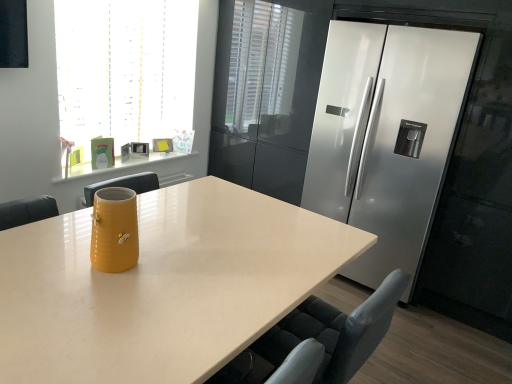
The height and width of the screenshot is (384, 512). What are the coordinates of `matte yellow vase at center` in the screenshot? It's located at (359, 248).

What do you see at coordinates (359, 248) in the screenshot?
I see `matte yellow vase at center` at bounding box center [359, 248].

Locate an element on the screen. The height and width of the screenshot is (384, 512). translucent glass window at upper left is located at coordinates (125, 74).

This screenshot has width=512, height=384. I want to click on matte yellow vase at center, so click(x=359, y=248).

Where is `swivel chair to the right of yellow matte mug at upper left`? swivel chair to the right of yellow matte mug at upper left is located at coordinates click(332, 334).

Is point (198, 152) positioned in front of point (311, 327)?

No, (198, 152) is further to viewer.

Could you tell me if yellow matte mug at upper left is facing matte gray swivel chair at lower right?

Yes, yellow matte mug at upper left is oriented towards matte gray swivel chair at lower right.

Can you confirm if yellow matte mug at upper left is positioned to the left of matte gray swivel chair at lower right?

Yes.

Does yellow ceramic vase at center contain translucent glass window at upper left?

No, translucent glass window at upper left is not surrounded by yellow ceramic vase at center.

Which is more to the right, yellow ceramic vase at center or translucent glass window at upper left?

From the viewer's perspective, yellow ceramic vase at center appears more on the right side.

You are a GUI agent. You are given a task and a screenshot of the screen. Output one action in this format:
    pyautogui.click(x=<x>, y=<y>)
    Task: Click on the jug that is below the translucent glass window at upper left (from the image's perspective)
    This screenshot has height=384, width=512.
    Given the screenshot: What is the action you would take?
    pyautogui.click(x=114, y=230)

Between point (113, 209) and point (143, 55), which one is positioned in front?

The point (113, 209) is closer to the camera.

Which is behind, yellow matte mug at upper left or yellow ceramic vase at center?

yellow matte mug at upper left is behind.

In the image, is yellow matte mug at upper left on the left side or the right side of yellow ceramic vase at center?

Based on their positions, yellow matte mug at upper left is located to the left of yellow ceramic vase at center.

Are yellow matte mug at upper left and yellow ceramic vase at center making contact?

They are not placed beside each other.

Considering the relative sizes of yellow matte mug at upper left and yellow ceramic vase at center in the image provided, is yellow matte mug at upper left thinner than yellow ceramic vase at center?

No.

Is yellow matte mug at upper left beside satin silver refrigerator at right?

No, yellow matte mug at upper left is not in contact with satin silver refrigerator at right.

In order to click on counter on the left of satin silver refrigerator at right in this screenshot , I will do `click(119, 164)`.

Relative to satin silver refrigerator at right, is yellow matte mug at upper left in front or behind?

yellow matte mug at upper left is positioned farther from the viewer than satin silver refrigerator at right.

Based on the photo, what's the angular difference between yellow matte mug at upper left and satin silver refrigerator at right's facing directions?

The angle between the facing direction of yellow matte mug at upper left and the facing direction of satin silver refrigerator at right is 90.1 degrees.

Considering the points (81, 240) and (304, 340), which point is behind, point (81, 240) or point (304, 340)?

Point (81, 240)

From the image's perspective, between matte yellow vase at center and matte gray swivel chair at lower right, which one is located above?

matte gray swivel chair at lower right is shown above in the image.

What's the angular difference between matte yellow vase at center and matte gray swivel chair at lower right's facing directions?

The facing directions of matte yellow vase at center and matte gray swivel chair at lower right are 179 degrees apart.

From a real-world perspective, is matte yellow vase at center physically located above or below matte gray swivel chair at lower right?

matte yellow vase at center is below matte gray swivel chair at lower right.

Which object is further away from the camera taking this photo, translucent glass window at upper left or yellow matte mug at upper left?

yellow matte mug at upper left.

Which is closer, [160,96] or [101,169]?

The point [101,169] is closer to the camera.

From the image's perspective, which is above, translucent glass window at upper left or yellow matte mug at upper left?

translucent glass window at upper left.

Is translucent glass window at upper left aimed at yellow matte mug at upper left?

No.

Looking at this image, does satin silver refrigerator at right have a smaller size compared to matte yellow vase at center?

Yes, satin silver refrigerator at right is smaller than matte yellow vase at center.

Which is more to the left, satin silver refrigerator at right or matte yellow vase at center?

Positioned to the left is matte yellow vase at center.

Does point (331, 81) lie in front of point (264, 323)?

That is False.

Looking at this image, which object is further away from the camera, satin silver refrigerator at right or matte yellow vase at center?

satin silver refrigerator at right is more distant.

Where is `swivel chair to the right of yellow matte mug at upper left`? This screenshot has width=512, height=384. swivel chair to the right of yellow matte mug at upper left is located at coordinates pos(332,334).

At what (x,y) coordinates should I click in order to perform the action: click on window lying above the yellow ceramic vase at center (from the image's perspective). Please return your answer as a coordinate pair (x, y). Looking at the image, I should click on (125, 74).

Considering their positions, is yellow matte mug at upper left positioned closer to translucent glass window at upper left than yellow ceramic vase at center?

Among the two, yellow matte mug at upper left is located nearer to translucent glass window at upper left.

Which object lies further to the anchor point yellow ceramic vase at center, satin silver refrigerator at right or yellow matte mug at upper left?

The object further to yellow ceramic vase at center is satin silver refrigerator at right.

When comparing their distances from matte gray swivel chair at lower right, does yellow ceramic vase at center or satin silver refrigerator at right seem further?

Based on the image, satin silver refrigerator at right appears to be further to matte gray swivel chair at lower right.

Which object lies nearer to the anchor point yellow matte mug at upper left, matte gray swivel chair at lower right or translucent glass window at upper left?

translucent glass window at upper left.

Estimate the real-world distances between objects in this image. Which object is closer to yellow matte mug at upper left, satin silver refrigerator at right or matte gray swivel chair at lower right?

satin silver refrigerator at right lies closer to yellow matte mug at upper left than the other object.

Based on their spatial positions, is satin silver refrigerator at right or matte yellow vase at center further from translucent glass window at upper left?

Based on the image, satin silver refrigerator at right appears to be further to translucent glass window at upper left.

Based on their spatial positions, is matte gray swivel chair at lower right or matte yellow vase at center further from yellow matte mug at upper left?

matte gray swivel chair at lower right is further to yellow matte mug at upper left.

From the image, which object appears to be nearer to matte yellow vase at center, matte gray swivel chair at lower right or yellow matte mug at upper left?

The object closer to matte yellow vase at center is matte gray swivel chair at lower right.

Identify the location of window between matte gray swivel chair at lower right and yellow matte mug at upper left from front to back. (125, 74).

I want to click on jug between matte gray swivel chair at lower right and yellow matte mug at upper left in the front-back direction, so click(114, 230).

Find the location of a particular element. swivel chair between matte yellow vase at center and yellow matte mug at upper left in the front-back direction is located at coordinates (332, 334).

Find the location of a particular element. This screenshot has height=384, width=512. jug between translucent glass window at upper left and matte gray swivel chair at lower right from top to bottom is located at coordinates (114, 230).